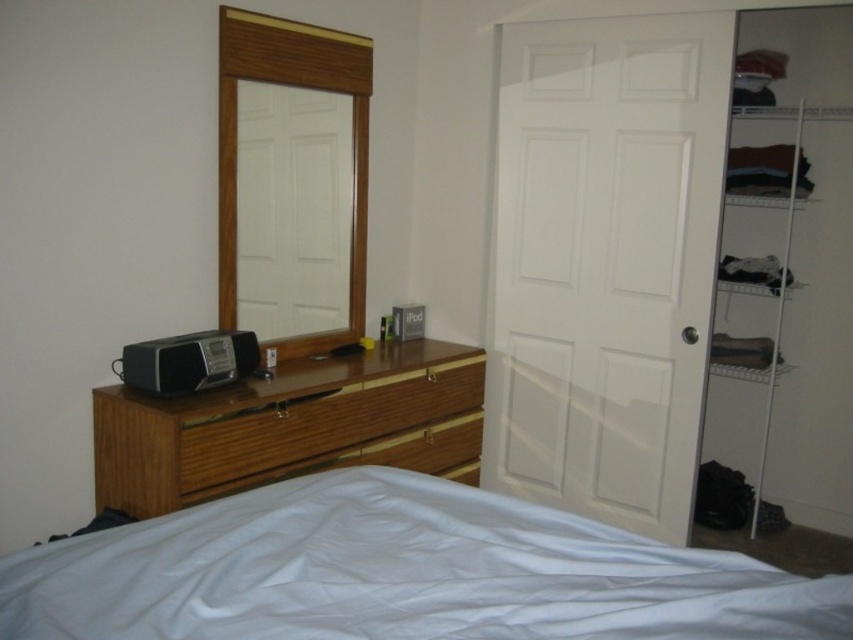
You are standing in the bedroom corner shown in the image. You see a point at coordinate (289, 426). What object in the scene is located at this coordinate?

The wooden material textured dresser at left is located at coordinate point (289, 426).

You are organizing the bedroom and need to place a new decorative item. The item is larger than the satin black radio at center but smaller than the white smooth bedcover at lower center. Where could you place this new item without overlapping either of them?

The new item can be placed on the wooden dresser to the left of the bed, as it is larger than the satin black radio at center but smaller than the white smooth bedcover at lower center and there is space available on the dresser.